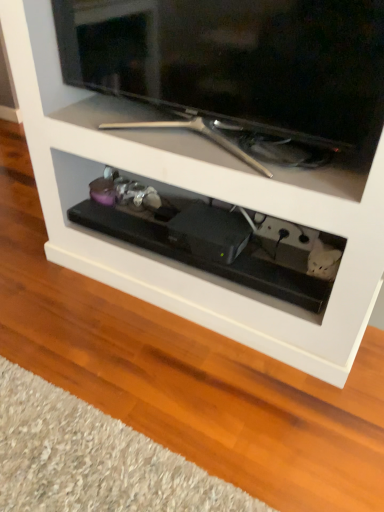
Question: From a real-world perspective, is matte black television at upper center physically located above or below black plastic drawer at center?

Choices:
 (A) below
 (B) above

Answer: (B)

Question: Is matte black television at upper center inside or outside of black plastic drawer at center?

Choices:
 (A) outside
 (B) inside

Answer: (A)

Question: Is point 279,102 positioned closer to the camera than point 99,216?

Choices:
 (A) closer
 (B) farther

Answer: (A)

Question: From a real-world perspective, is black plastic drawer at center positioned above or below matte black television at upper center?

Choices:
 (A) above
 (B) below

Answer: (B)

Question: In terms of height, does black plastic drawer at center look taller or shorter compared to matte black television at upper center?

Choices:
 (A) tall
 (B) short

Answer: (B)

Question: Looking at their shapes, would you say black plastic drawer at center is wider or thinner than matte black television at upper center?

Choices:
 (A) thin
 (B) wide

Answer: (B)

Question: From the image's perspective, relative to matte black television at upper center, is black plastic drawer at center above or below?

Choices:
 (A) above
 (B) below

Answer: (B)